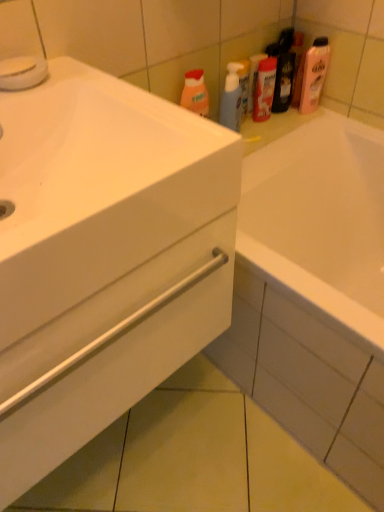
Question: Is matte plastic mouthwash at upper center bigger than white glossy cabinet at lower left?

Choices:
 (A) yes
 (B) no

Answer: (B)

Question: Is the depth of matte plastic mouthwash at upper center greater than that of white glossy cabinet at lower left?

Choices:
 (A) no
 (B) yes

Answer: (B)

Question: Is matte plastic mouthwash at upper center thinner than white glossy cabinet at lower left?

Choices:
 (A) yes
 (B) no

Answer: (A)

Question: From the image's perspective, is matte plastic mouthwash at upper center beneath white glossy cabinet at lower left?

Choices:
 (A) no
 (B) yes

Answer: (A)

Question: Does matte plastic mouthwash at upper center have a greater height compared to white glossy cabinet at lower left?

Choices:
 (A) yes
 (B) no

Answer: (B)

Question: Considering the positions of point (258, 102) and point (152, 304), is point (258, 102) closer or farther from the camera than point (152, 304)?

Choices:
 (A) farther
 (B) closer

Answer: (A)

Question: Considering the relative positions of matte plastic mouthwash at upper center and white glossy cabinet at lower left in the image provided, is matte plastic mouthwash at upper center to the left or to the right of white glossy cabinet at lower left?

Choices:
 (A) left
 (B) right

Answer: (B)

Question: Do you think matte plastic mouthwash at upper center is within white glossy cabinet at lower left, or outside of it?

Choices:
 (A) outside
 (B) inside

Answer: (A)

Question: From a real-world perspective, is matte plastic mouthwash at upper center above or below white glossy cabinet at lower left?

Choices:
 (A) above
 (B) below

Answer: (A)

Question: Relative to pink glossy lotion at upper right, the second cleaning product positioned from the left, is translucent plastic spray bottle at upper center, which is the first cleaning product from left to right, in front or behind?

Choices:
 (A) front
 (B) behind

Answer: (B)

Question: Based on their positions, is translucent plastic spray bottle at upper center, which is the first cleaning product from left to right, located to the left or right of pink glossy lotion at upper right, the second cleaning product positioned from the left?

Choices:
 (A) right
 (B) left

Answer: (B)

Question: From a real-world perspective, is translucent plastic spray bottle at upper center, which ranks as the 2th cleaning product in right-to-left order, physically located above or below pink glossy lotion at upper right, the second cleaning product positioned from the left?

Choices:
 (A) below
 (B) above

Answer: (A)

Question: In terms of size, does translucent plastic spray bottle at upper center, which ranks as the 2th cleaning product in right-to-left order, appear bigger or smaller than pink glossy lotion at upper right, placed as the first cleaning product when sorted from right to left?

Choices:
 (A) small
 (B) big

Answer: (A)

Question: From the image's perspective, is pink glossy lotion at upper right, the second cleaning product positioned from the left, above or below white glossy cabinet at lower left?

Choices:
 (A) above
 (B) below

Answer: (A)

Question: In the image, is pink glossy lotion at upper right, placed as the first cleaning product when sorted from right to left, on the left side or the right side of white glossy cabinet at lower left?

Choices:
 (A) right
 (B) left

Answer: (A)